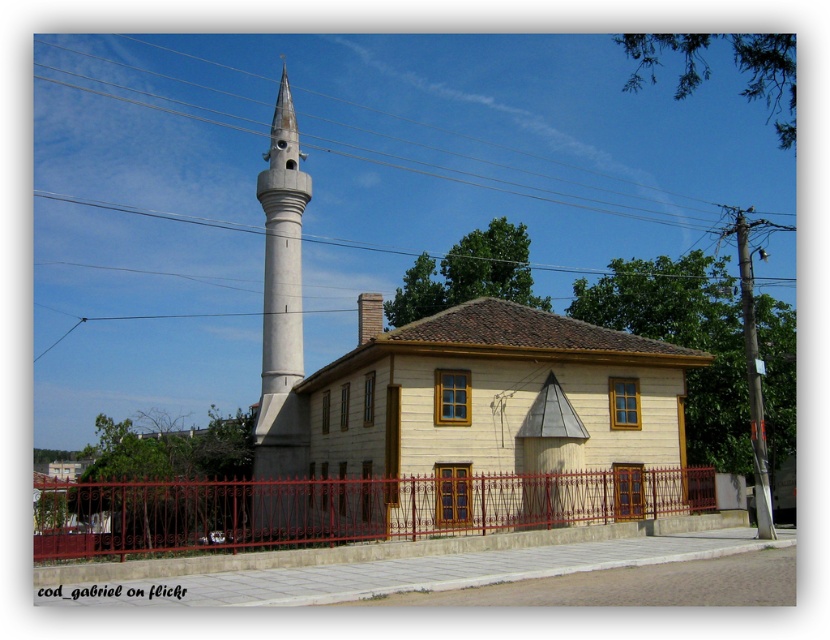
You are standing in front of the mosque and want to compare the height of the metallic wire at upper center and the white concrete minaret at left. Which one is taller?

The white concrete minaret at left is taller than the metallic wire at upper center.

You are standing in front of the mosque and want to take a photo that includes both the red wrought iron fence at lower center and the metallic wire at upper center. Which object will appear larger in the photo?

The red wrought iron fence at lower center will appear larger in the photo because it is closer to the viewer than the metallic wire at upper center.

You are standing at the entrance of the mosque and want to locate two specific points marked on the ground. The first point is at coordinate point(438, 532) and the second is at point(528, 189). Based on the scene description, which point is closer to the entrance?

Point(438, 532) is in front of point(528, 189), so it is closer to the entrance.